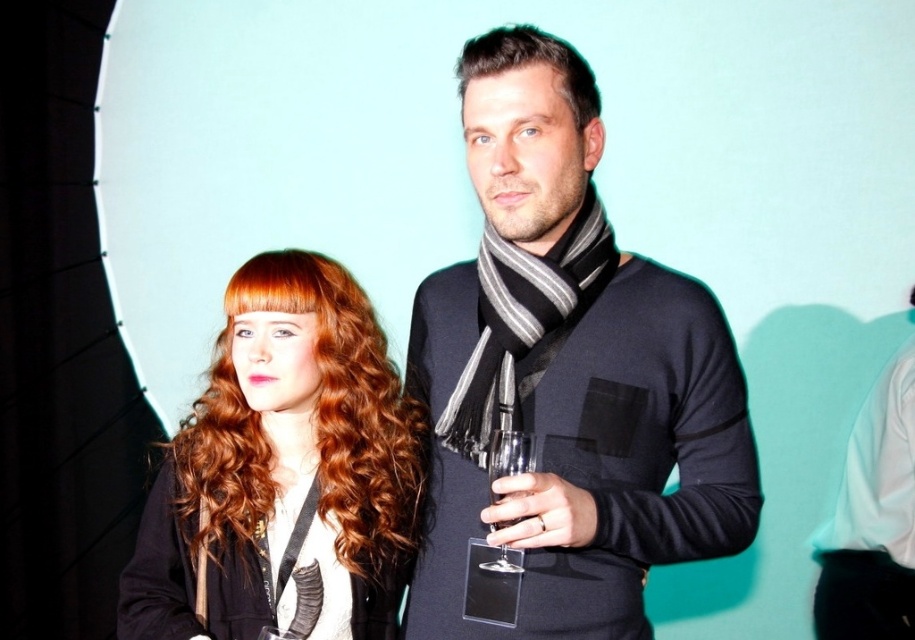
Question: Can you confirm if matte black scarf at center is smaller than white textured dress at center?

Choices:
 (A) yes
 (B) no

Answer: (B)

Question: Considering the real-world distances, which object is farthest from the clear glass wine glass at center?

Choices:
 (A) white textured dress at center
 (B) dark brown hair at center
 (C) shiny red hair at center
 (D) matte black glass at center

Answer: (B)

Question: Which of the following is the farthest from the observer?

Choices:
 (A) shiny red hair at center
 (B) matte black scarf at center

Answer: (A)

Question: Among these points, which one is nearest to the camera?

Choices:
 (A) (509, 428)
 (B) (262, 380)
 (C) (367, 612)

Answer: (A)

Question: Does matte black scarf at center come behind dark brown hair at center?

Choices:
 (A) no
 (B) yes

Answer: (A)

Question: Does matte black scarf at center lie in front of dark brown hair at center?

Choices:
 (A) no
 (B) yes

Answer: (B)